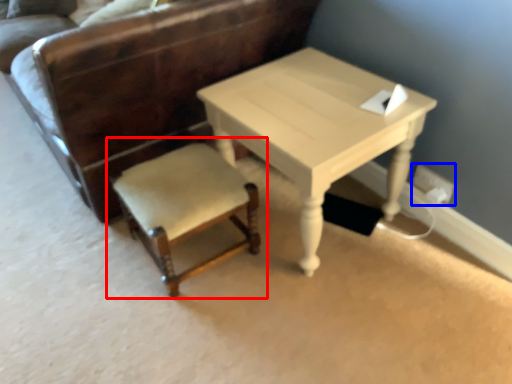
Question: Which of the following is the closest to the observer, chair (highlighted by a red box) or electric outlet (highlighted by a blue box)?

Choices:
 (A) chair
 (B) electric outlet

Answer: (A)